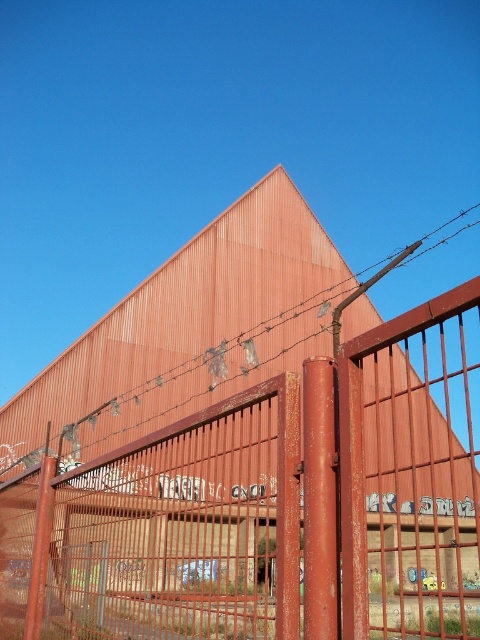
Question: Which object appears closest to the camera in this image?

Choices:
 (A) rusty metal gate at center
 (B) rusty wire at center

Answer: (A)

Question: Which of the following is the closest to the observer?

Choices:
 (A) rusty wire at center
 (B) rusty metal gate at center

Answer: (B)

Question: Among these points, which one is farthest from the camera?

Choices:
 (A) (87, 404)
 (B) (201, 413)

Answer: (A)

Question: Where is rusty metal gate at center located in relation to rusty wire at center in the image?

Choices:
 (A) below
 (B) above

Answer: (A)

Question: Can you confirm if rusty metal gate at center is positioned to the left of rusty wire at center?

Choices:
 (A) no
 (B) yes

Answer: (B)

Question: Observing the image, what is the correct spatial positioning of rusty metal gate at center in reference to rusty wire at center?

Choices:
 (A) above
 (B) below

Answer: (B)